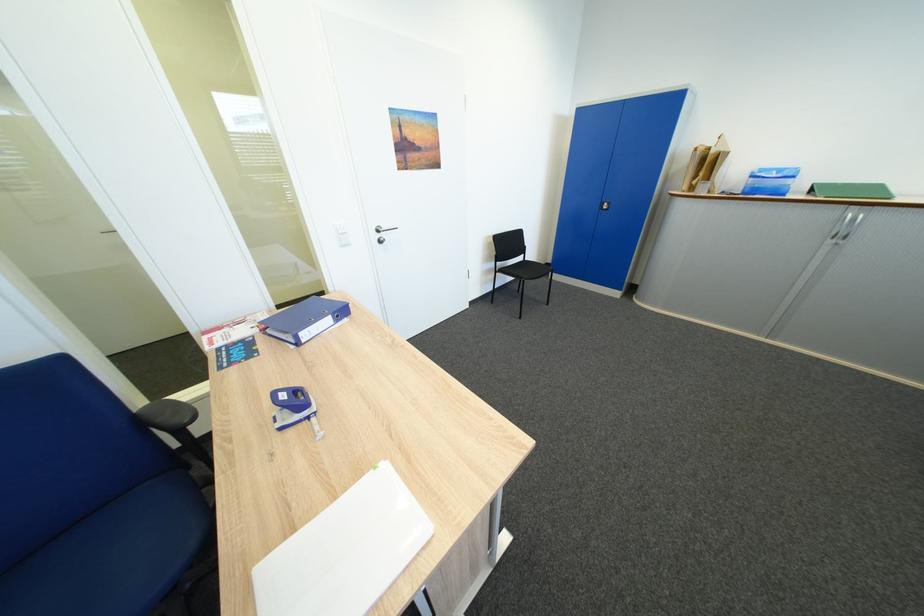
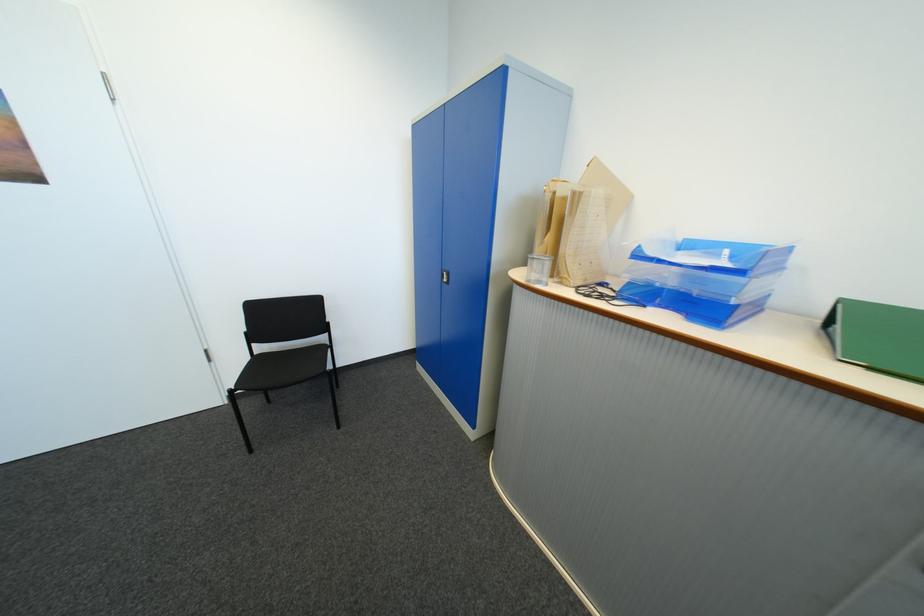
Which direction would the cameraman need to move to produce the second image?

The cameraman moved toward right, forward.